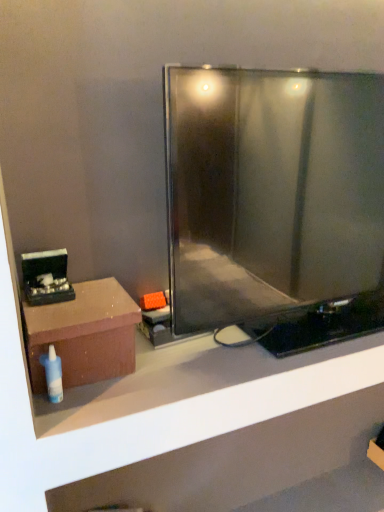
Where is `vacant area that is situated to the right of white plastic bottle at lower left`? This screenshot has height=512, width=384. vacant area that is situated to the right of white plastic bottle at lower left is located at coordinates (139, 387).